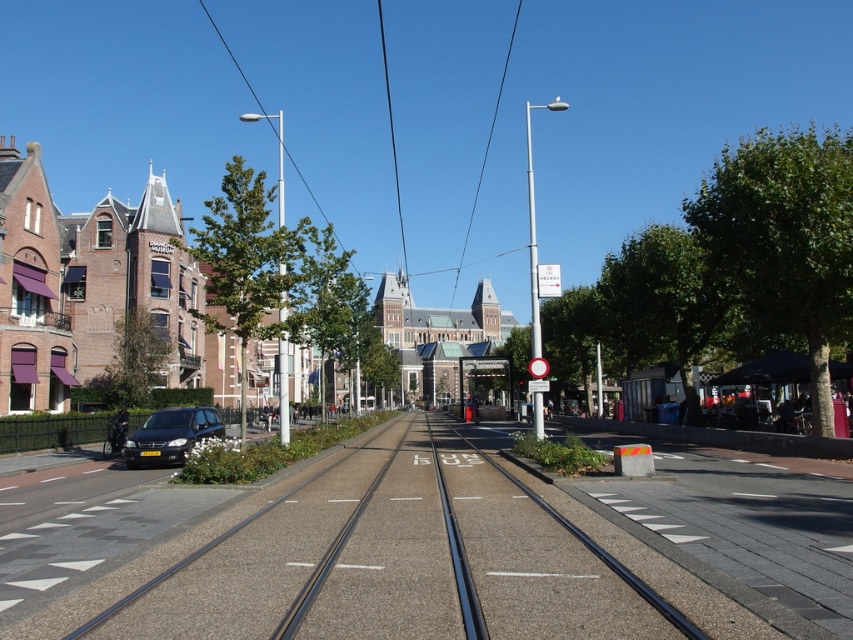
In the scene shown: Does black asphalt track at center have a lesser width compared to satin black car at lower left?

No, black asphalt track at center is not thinner than satin black car at lower left.

Is black asphalt track at center wider than satin black car at lower left?

Yes, black asphalt track at center is wider than satin black car at lower left.

Where is `black asphalt track at center`? The height and width of the screenshot is (640, 853). black asphalt track at center is located at coordinates (389, 557).